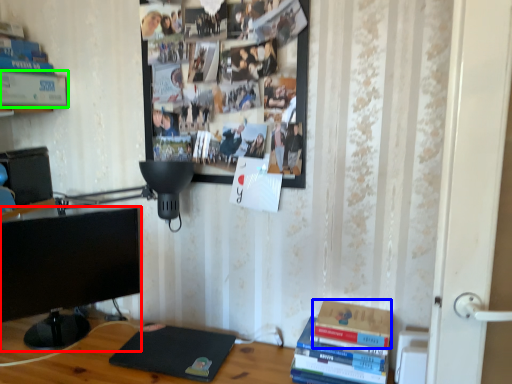
Question: Considering the real-world distances, which object is closest to television (highlighted by a red box)? paperback book (highlighted by a blue box) or paperback book (highlighted by a green box).

Choices:
 (A) paperback book
 (B) paperback book

Answer: (B)